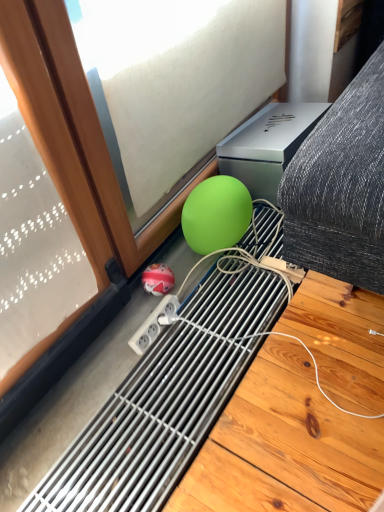
Question: Relative to green matte sphere at lower center, is shiny red ball at lower center, positioned as the 1th ball in left-to-right order, in front or behind?

Choices:
 (A) front
 (B) behind

Answer: (B)

Question: In the image, is shiny red ball at lower center, positioned as the 1th ball in left-to-right order, on the left side or the right side of green matte sphere at lower center?

Choices:
 (A) left
 (B) right

Answer: (A)

Question: Based on their relative distances, which object is nearer to the shiny red ball at lower center, the 2th ball from the right?

Choices:
 (A) green matte sphere at lower center
 (B) green matte ball at lower center, which is counted as the 2th ball, starting from the bottom

Answer: (B)

Question: Based on their relative distances, which object is farther from the green matte sphere at lower center?

Choices:
 (A) green matte ball at lower center, the 2th ball in the left-to-right sequence
 (B) shiny red ball at lower center, which ranks as the 1th ball in bottom-to-top order

Answer: (B)